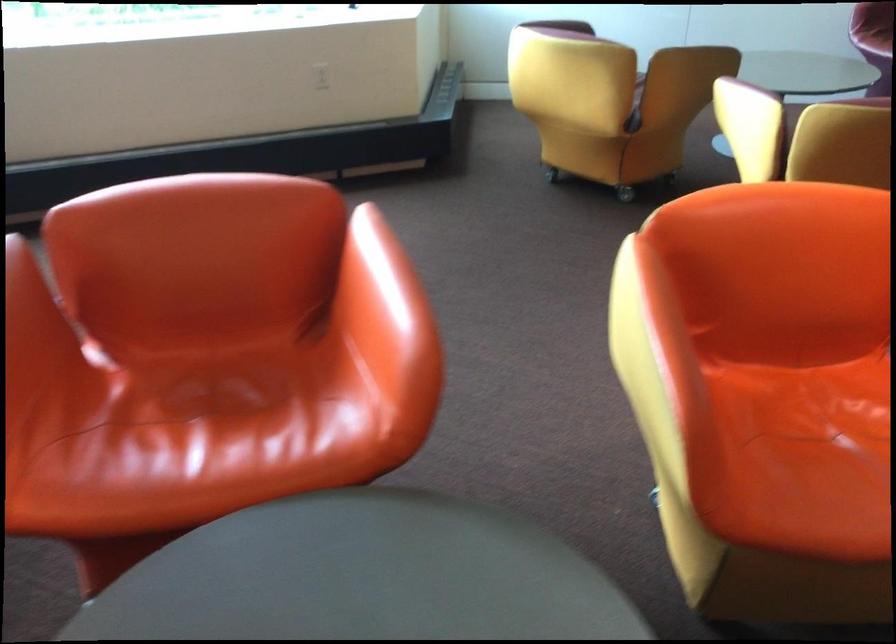
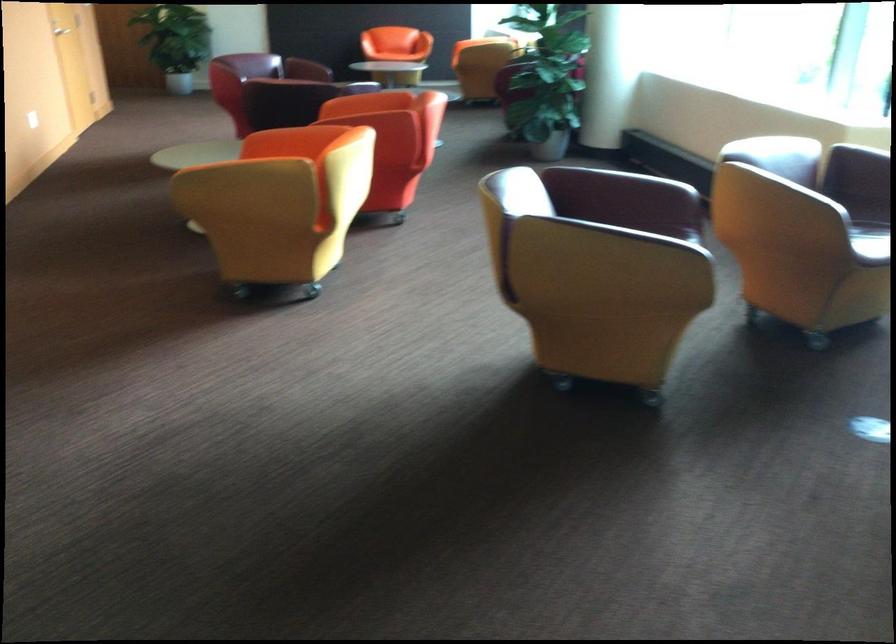
Question: I am providing you with two images of the same scene from different viewpoints. Please identify which objects are invisible in image2.

Choices:
 (A) green ceramic bowl
 (B) yellow chair armrest
 (C) orange chair sitting surface
 (D) purple chair sitting surface

Answer: (C)